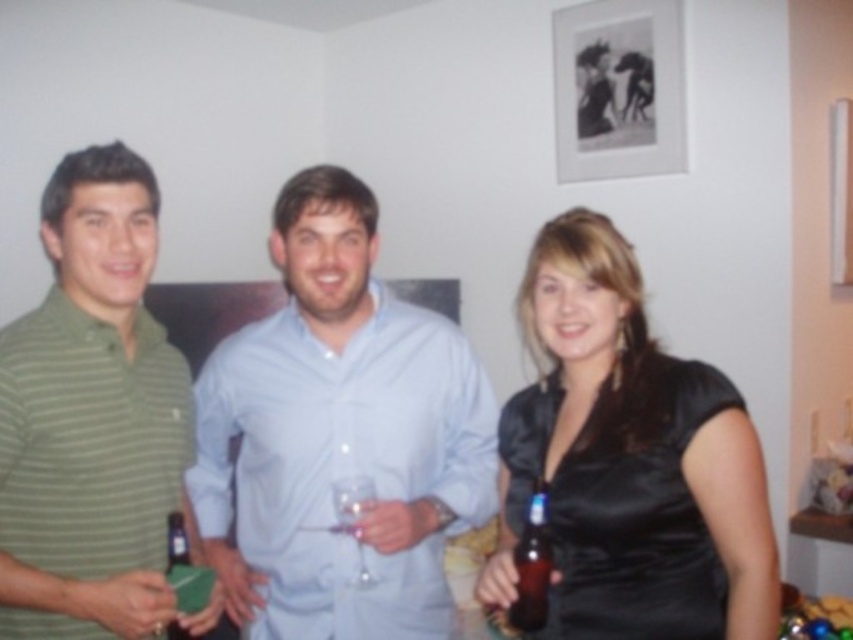
Is point (9, 499) farther from camera compared to point (190, 636)?

No.

Is green striped polo shirt at left further to camera compared to translucent plastic bottle at lower left?

No, green striped polo shirt at left is closer to the viewer.

Between point (125, 506) and point (177, 628), which one is positioned behind?

Point (125, 506)

Where is `green striped polo shirt at left`? green striped polo shirt at left is located at coordinates (93, 419).

Can you confirm if satin black dress at center is positioned to the right of clear glass wine glass at center?

Indeed, satin black dress at center is positioned on the right side of clear glass wine glass at center.

Where is `satin black dress at center`? satin black dress at center is located at coordinates (628, 461).

Where is `black paper at upper center`? This screenshot has height=640, width=853. black paper at upper center is located at coordinates 618,88.

Between point (633, 120) and point (531, 612), which one is positioned behind?

Point (633, 120)

Find the location of `black paper at upper center`. black paper at upper center is located at coordinates (618, 88).